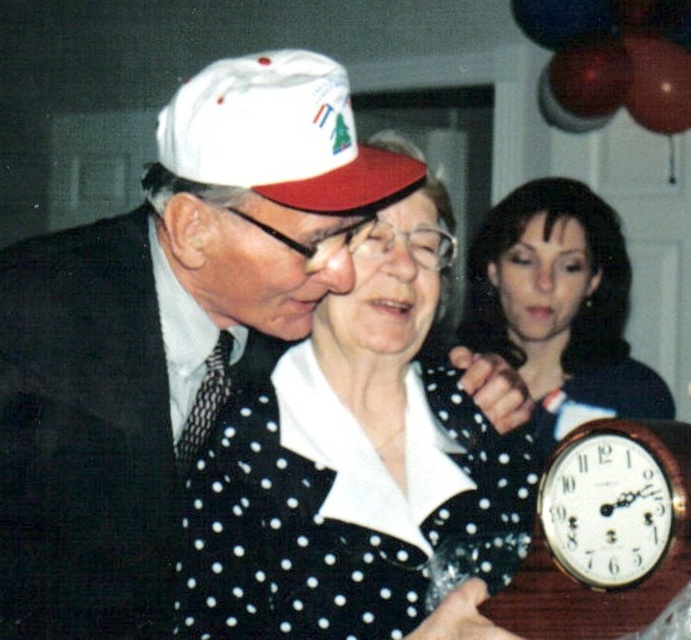
Question: Can you confirm if white dotted fabric at center is positioned to the right of polka dot blouse at center?

Choices:
 (A) no
 (B) yes

Answer: (A)

Question: Observing the image, what is the correct spatial positioning of white matte hat at upper left in reference to wooden clock at lower right?

Choices:
 (A) left
 (B) right

Answer: (A)

Question: Which point is farther from the camera taking this photo?

Choices:
 (A) (171, 488)
 (B) (614, 520)

Answer: (A)

Question: Is white matte baseball cap at upper center to the left of wooden clock at lower right from the viewer's perspective?

Choices:
 (A) no
 (B) yes

Answer: (B)

Question: Based on their relative distances, which object is nearer to the wooden clock at lower right?

Choices:
 (A) white matte hat at upper left
 (B) white dotted fabric at center
 (C) white matte baseball cap at upper center
 (D) polka dot blouse at center

Answer: (B)

Question: Estimate the real-world distances between objects in this image. Which object is closer to the white dotted fabric at center?

Choices:
 (A) white matte hat at upper left
 (B) wooden clock at lower right

Answer: (A)